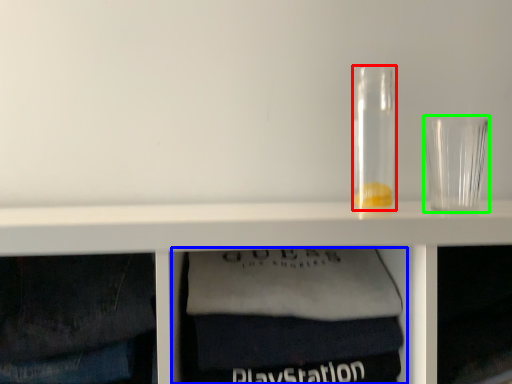
Question: Based on their relative distances, which object is farther from glass jar (highlighted by a red box)? Choose from cabinet (highlighted by a blue box) and shot glass (highlighted by a green box).

Choices:
 (A) cabinet
 (B) shot glass

Answer: (A)